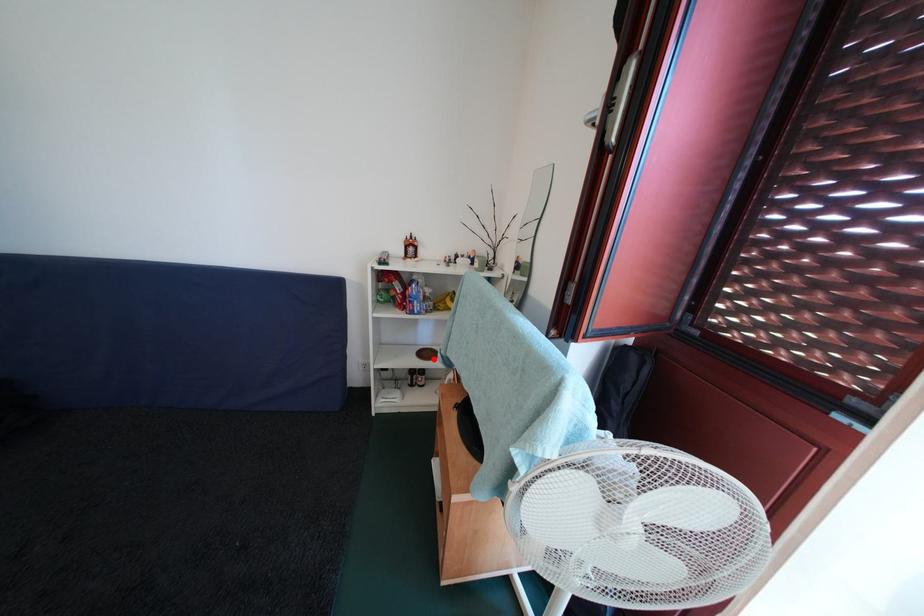
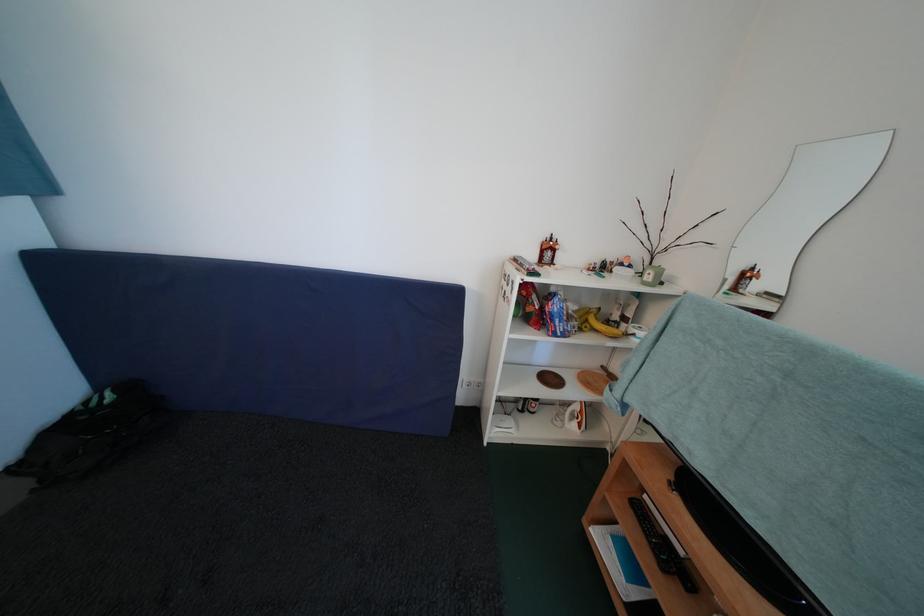
In the second image, find the point that corresponds to the highlighted location in the first image.

(556, 384)